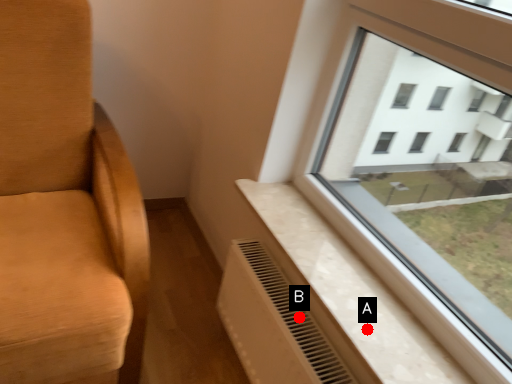
Question: Two points are circled on the image, labeled by A and B beside each circle. Which point appears closest to the camera in this image?

Choices:
 (A) A is closer
 (B) B is closer

Answer: (A)